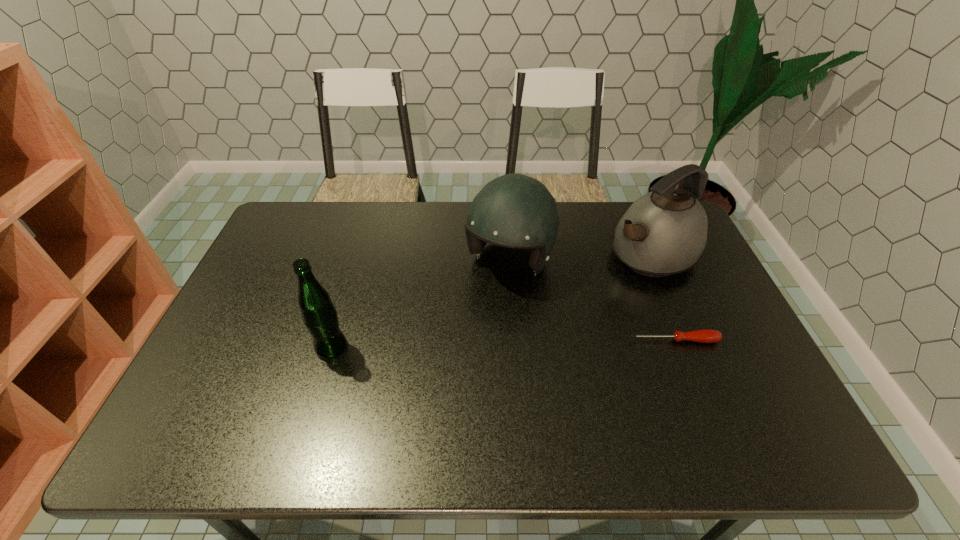
You are a GUI agent. You are given a task and a screenshot of the screen. Output one action in this format:
    pyautogui.click(x=<x>, y=<y>)
    Task: Click on the object that stands as the second closest to the kettle
    This screenshot has height=540, width=960.
    Given the screenshot: What is the action you would take?
    pyautogui.click(x=704, y=335)

At what (x,y) coordinates should I click in order to perform the action: click on vacant region that satisfies the following two spatial constraints: 1. on the back side of the leftmost object; 2. on the right side of the third object from right to left. Please return your answer as a coordinate pair (x, y). The width and height of the screenshot is (960, 540). Looking at the image, I should click on (357, 260).